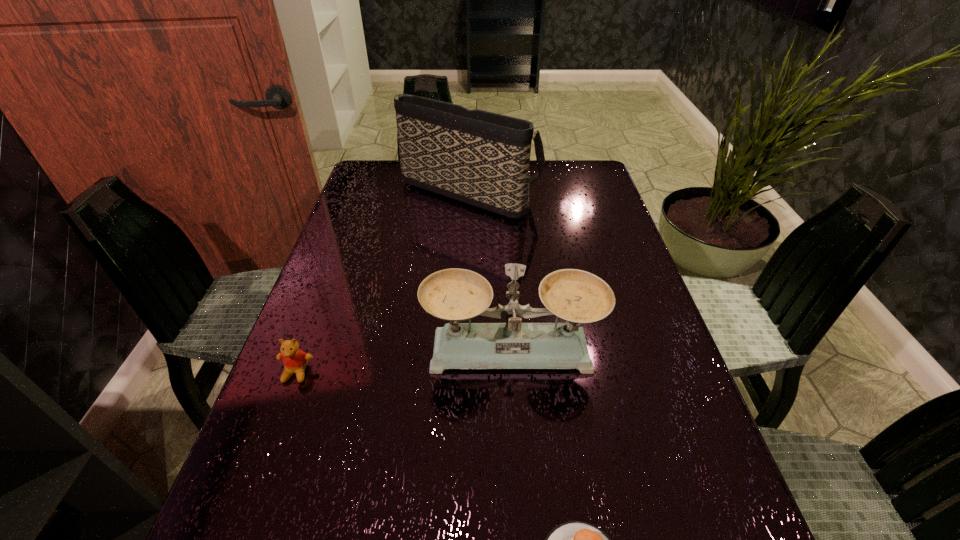
Locate an element on the screen. The image size is (960, 540). teddy bear at the left edge is located at coordinates (295, 360).

The width and height of the screenshot is (960, 540). What are the coordinates of `object at the right edge` in the screenshot? It's located at (577, 296).

At what (x,y) coordinates should I click in order to perform the action: click on object that is positioned at the far left corner. Please return your answer as a coordinate pair (x, y). This screenshot has width=960, height=540. Looking at the image, I should click on (481, 158).

What are the coordinates of `vacant space at the far edge of the desktop` in the screenshot? It's located at (546, 194).

Where is `vacant region at the left edge of the desktop`? This screenshot has width=960, height=540. vacant region at the left edge of the desktop is located at coordinates (397, 229).

Where is `free space at the right edge of the desktop`? The width and height of the screenshot is (960, 540). free space at the right edge of the desktop is located at coordinates (606, 244).

Image resolution: width=960 pixels, height=540 pixels. In the image, there is a desktop. In order to click on blank space at the far left corner in this screenshot , I will do (384, 177).

Find the location of a particular element. The height and width of the screenshot is (540, 960). vacant region between the third tallest object and the third shortest object is located at coordinates (404, 361).

You are a GUI agent. You are given a task and a screenshot of the screen. Output one action in this format:
    pyautogui.click(x=<x>, y=<y>)
    Task: Click on the vacant point located between the leftmost object and the farthest object
    This screenshot has width=960, height=540.
    Given the screenshot: What is the action you would take?
    pyautogui.click(x=383, y=281)

Where is `the third closest object to the teddy bear`? the third closest object to the teddy bear is located at coordinates (481, 158).